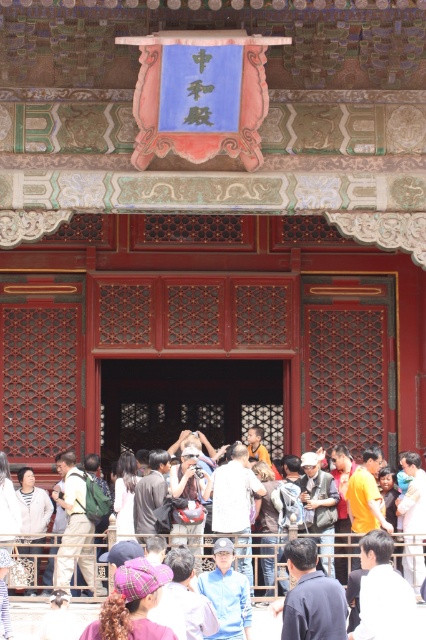
You are a visitor standing at the entrance of this traditional Chinese building. You notice a plaid fabric headscarf at lower center and a white fuzzy jacket at lower left. Which object is positioned lower in the scene?

The plaid fabric headscarf at lower center is positioned lower than the white fuzzy jacket at lower left according to the description.

You are a visitor at the entrance of this traditional Chinese building and notice two items near the door. The first is a plaid fabric headscarf at lower center, and the second is a white fuzzy jacket at lower left. Which item is smaller in size?

The plaid fabric headscarf at lower center has a smaller size compared to the white fuzzy jacket at lower left, so the plaid fabric headscarf at lower center is smaller.